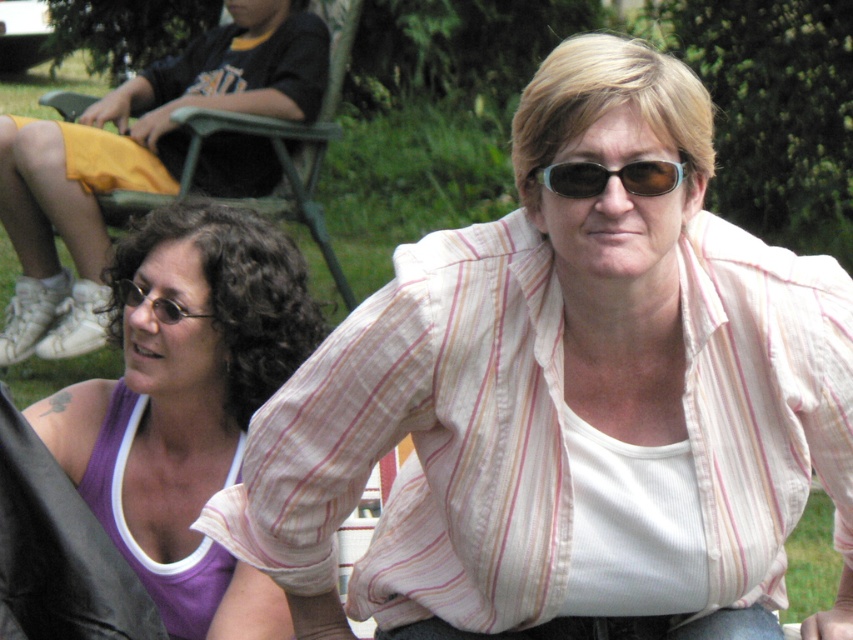
Is pink striped shirt at center to the left of purple fabric tank top at left from the viewer's perspective?

Incorrect, pink striped shirt at center is not on the left side of purple fabric tank top at left.

Who is more distant from viewer, (x=792, y=332) or (x=77, y=472)?

Point (x=77, y=472)

Where is `pink striped shirt at center`? pink striped shirt at center is located at coordinates (424, 442).

Find the location of a particular element. The image size is (853, 640). pink striped shirt at center is located at coordinates (424, 442).

Is green plastic chair at upper left in front of sunglasses at center?

No, green plastic chair at upper left is further to the viewer.

Can you confirm if green plastic chair at upper left is thinner than sunglasses at center?

No, green plastic chair at upper left is not thinner than sunglasses at center.

The width and height of the screenshot is (853, 640). What do you see at coordinates (306, 198) in the screenshot?
I see `green plastic chair at upper left` at bounding box center [306, 198].

Find the location of a particular element. The height and width of the screenshot is (640, 853). green plastic chair at upper left is located at coordinates (306, 198).

Is point (335, 134) farther from camera compared to point (178, 307)?

Yes, point (335, 134) is behind point (178, 307).

Is green plastic chair at upper left closer to camera compared to matte black glasses at lower left?

No.

In order to click on green plastic chair at upper left in this screenshot , I will do `click(306, 198)`.

Where is `green plastic chair at upper left`? Image resolution: width=853 pixels, height=640 pixels. green plastic chair at upper left is located at coordinates (306, 198).